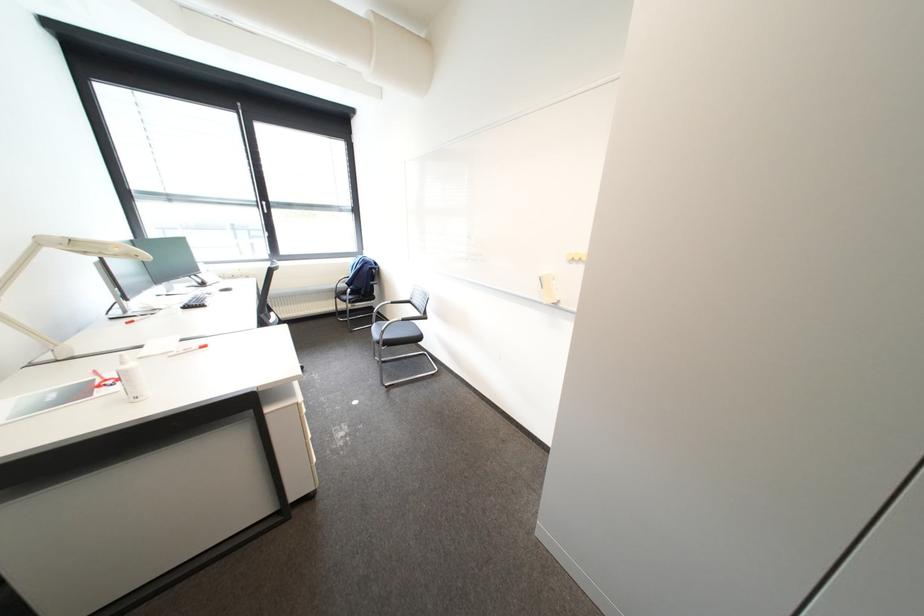
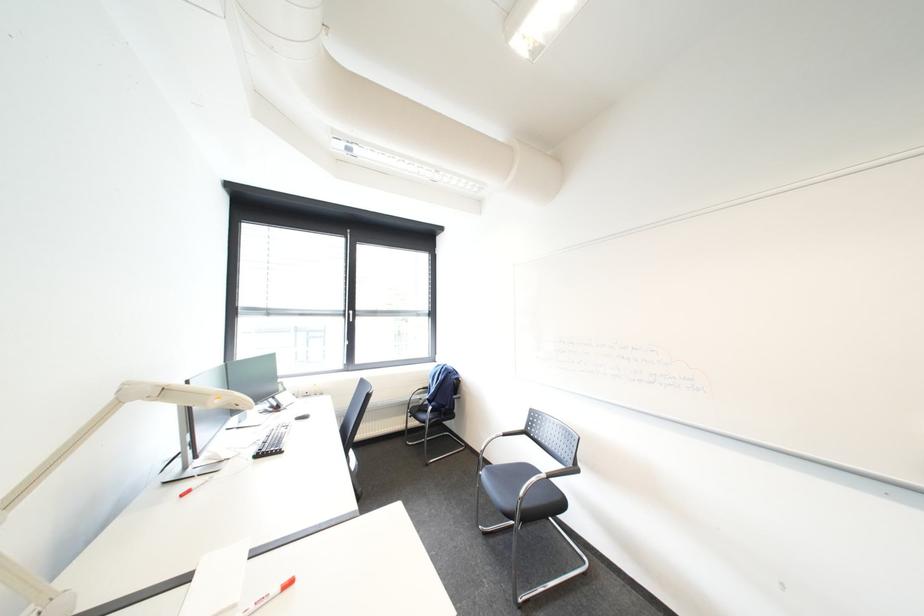
Question: Based on the continuous images, in which direction is the camera rotating? Reply with the corresponding letter.

Choices:
 (A) Left
 (B) Right
 (C) Up
 (D) Down

Answer: (C)